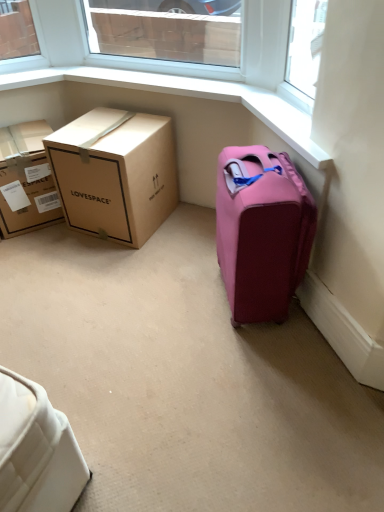
Question: From the image's perspective, is pink fabric suitcase at right positioned above or below clear glass window at upper center?

Choices:
 (A) above
 (B) below

Answer: (B)

Question: In the image, is pink fabric suitcase at right on the left side or the right side of clear glass window at upper center?

Choices:
 (A) left
 (B) right

Answer: (B)

Question: Which of these objects is positioned farthest from the brown cardboard box at left, the second box from the right?

Choices:
 (A) brown cardboard box at left, which is counted as the first box, starting from the right
 (B) pink fabric suitcase at right
 (C) clear glass window at upper center

Answer: (C)

Question: Which is farther from the brown cardboard box at left, which is counted as the first box, starting from the right?

Choices:
 (A) pink fabric suitcase at right
 (B) clear glass window at upper center
 (C) brown cardboard box at left, the second box from the right

Answer: (B)